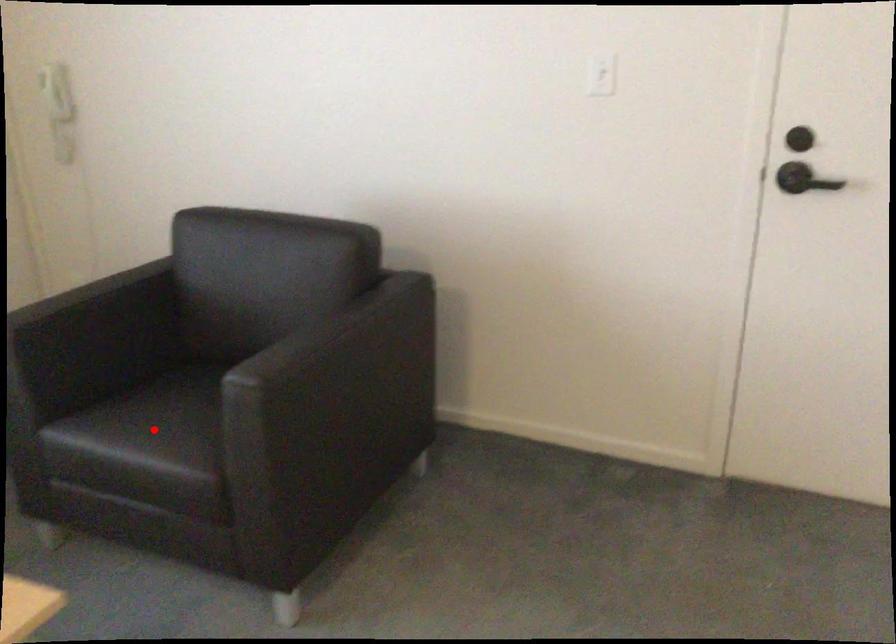
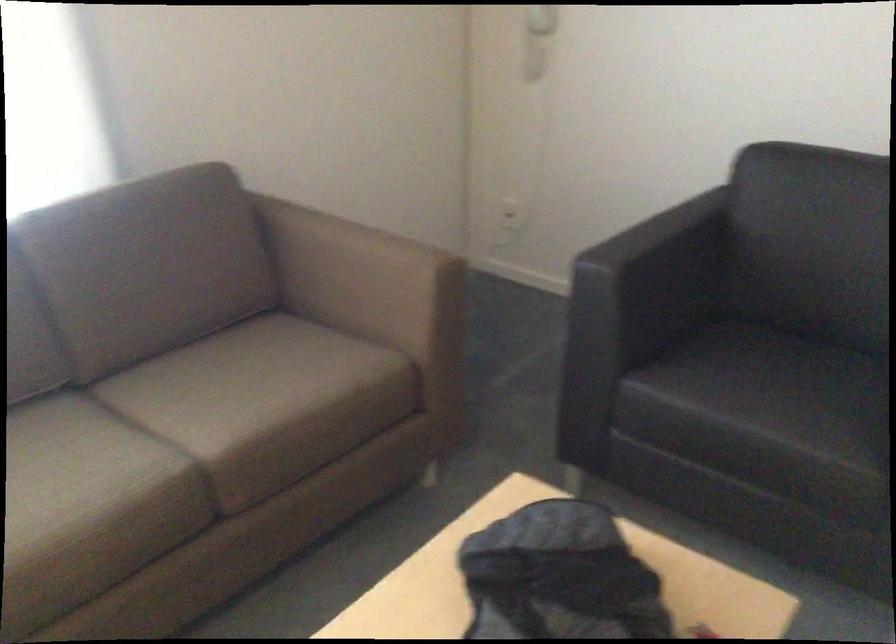
Locate, in the second image, the point that corresponds to the highlighted location in the first image.

(765, 397)